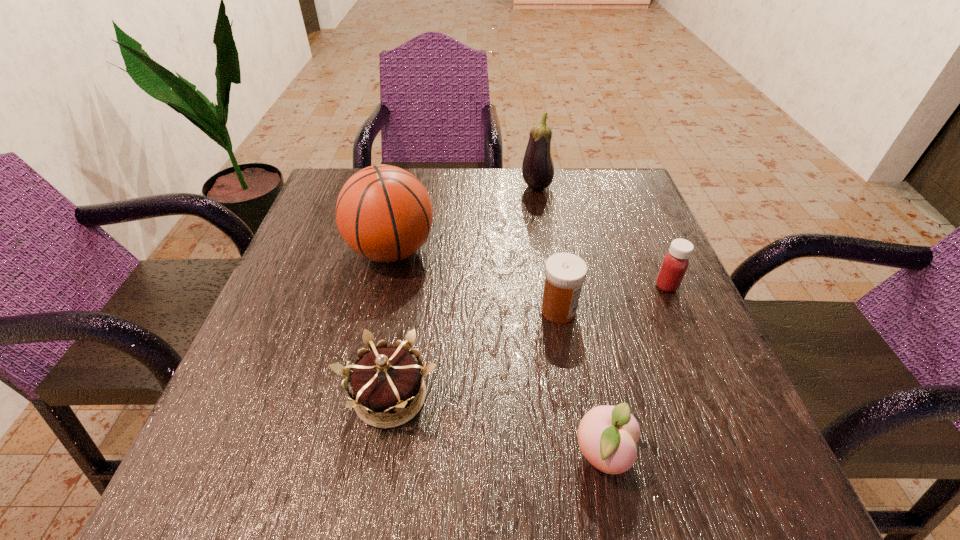
What are the coordinates of `eggplant` in the screenshot? It's located at (537, 169).

Locate an element on the screen. Image resolution: width=960 pixels, height=540 pixels. basketball is located at coordinates (384, 213).

I want to click on the left medicine, so click(565, 273).

Locate an element on the screen. the third nearest object is located at coordinates (565, 273).

This screenshot has height=540, width=960. In order to click on the rightmost object in this screenshot , I will do `click(675, 263)`.

Where is `the right medicine`? This screenshot has height=540, width=960. the right medicine is located at coordinates (675, 263).

At what (x,y) coordinates should I click in order to perform the action: click on crown. Please return your answer as a coordinate pair (x, y). The image size is (960, 540). Looking at the image, I should click on (385, 380).

Locate an element on the screen. The image size is (960, 540). peach is located at coordinates (607, 435).

Where is `vacant space situated on the right of the farthest object`? The width and height of the screenshot is (960, 540). vacant space situated on the right of the farthest object is located at coordinates (635, 188).

This screenshot has width=960, height=540. In order to click on vacant region located 0.120m on the right of the basketball in this screenshot , I will do `click(492, 251)`.